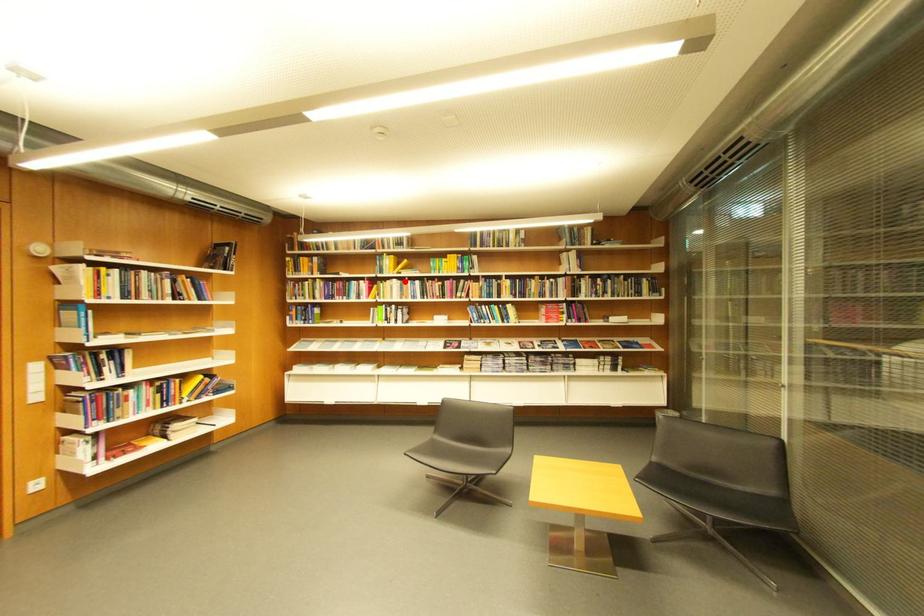
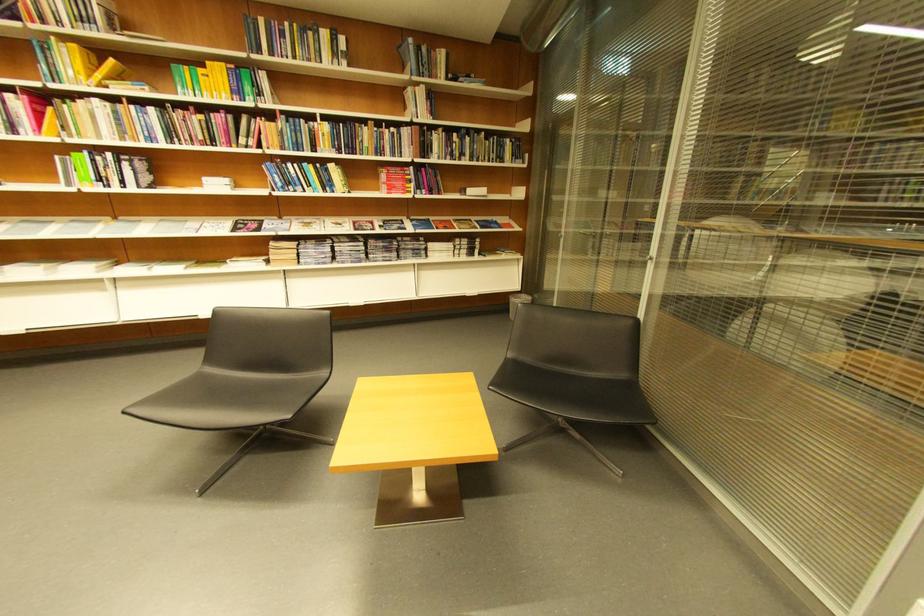
In the second image, find the point that corresponds to the highlighted location in the first image.

(106, 102)